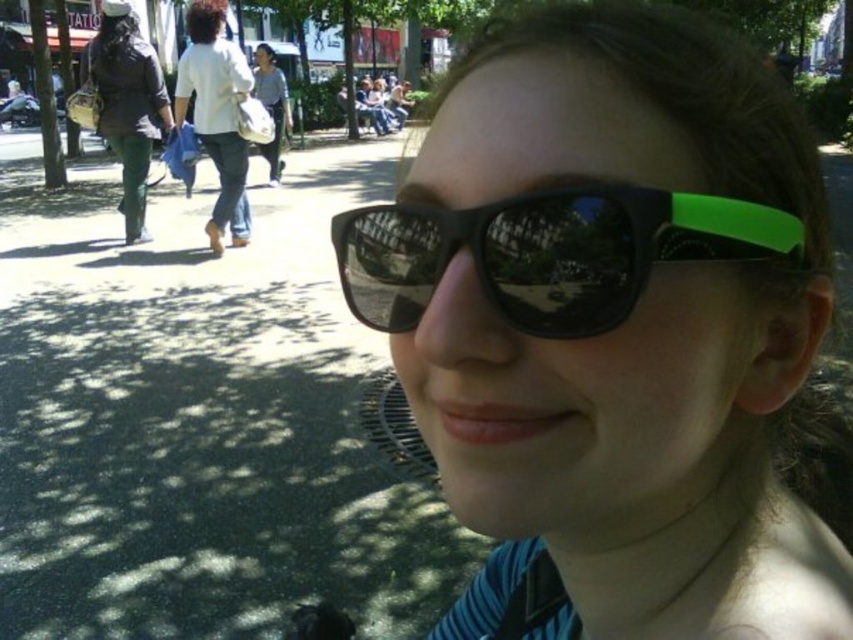
Who is more distant from viewer, (x=144, y=240) or (x=260, y=83)?

The point (x=260, y=83) is behind.

Can you confirm if dark green pants at left is thinner than light blue shirt at center?

Incorrect, dark green pants at left's width is not less than light blue shirt at center's.

Who is more forward, [112,54] or [280,120]?

Point [112,54] is more forward.

I want to click on dark green pants at left, so click(126, 104).

Does white cotton shirt at upper left have a larger size compared to dark green pants at left?

No.

This screenshot has height=640, width=853. What do you see at coordinates (216, 113) in the screenshot?
I see `white cotton shirt at upper left` at bounding box center [216, 113].

Locate an element on the screen. Image resolution: width=853 pixels, height=640 pixels. white cotton shirt at upper left is located at coordinates (216, 113).

Is black matte sunglasses at center to the left of dark green pants at left from the viewer's perspective?

No, black matte sunglasses at center is not to the left of dark green pants at left.

Who is lower down, black matte sunglasses at center or dark green pants at left?

black matte sunglasses at center is lower down.

Who is more forward, [492,253] or [86,68]?

Point [492,253]

You are a GUI agent. You are given a task and a screenshot of the screen. Output one action in this format:
    pyautogui.click(x=<x>, y=<y>)
    Task: Click on the black matte sunglasses at center
    
    Given the screenshot: What is the action you would take?
    pyautogui.click(x=548, y=252)